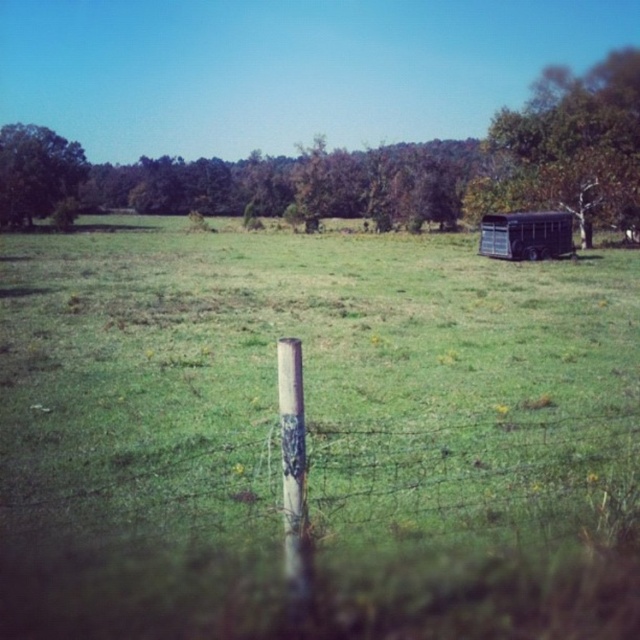
Question: Which object is closer to the camera taking this photo?

Choices:
 (A) green leafy tree at upper left
 (B) white wood pole at center

Answer: (B)

Question: Is the position of wooden post at center more distant than that of green leafy tree at upper right?

Choices:
 (A) no
 (B) yes

Answer: (A)

Question: Which is farther from the green leafy tree at upper left?

Choices:
 (A) metallic trailer at right
 (B) green leafy tree at upper right
 (C) white wood pole at center

Answer: (C)

Question: Does green leafy tree at upper right lie behind metallic trailer at right?

Choices:
 (A) yes
 (B) no

Answer: (A)

Question: Does wooden post at center have a larger size compared to green leafy tree at upper left?

Choices:
 (A) yes
 (B) no

Answer: (B)

Question: Which of the following is the farthest from the observer?

Choices:
 (A) (52, 184)
 (B) (323, 474)
 (C) (500, 241)

Answer: (A)